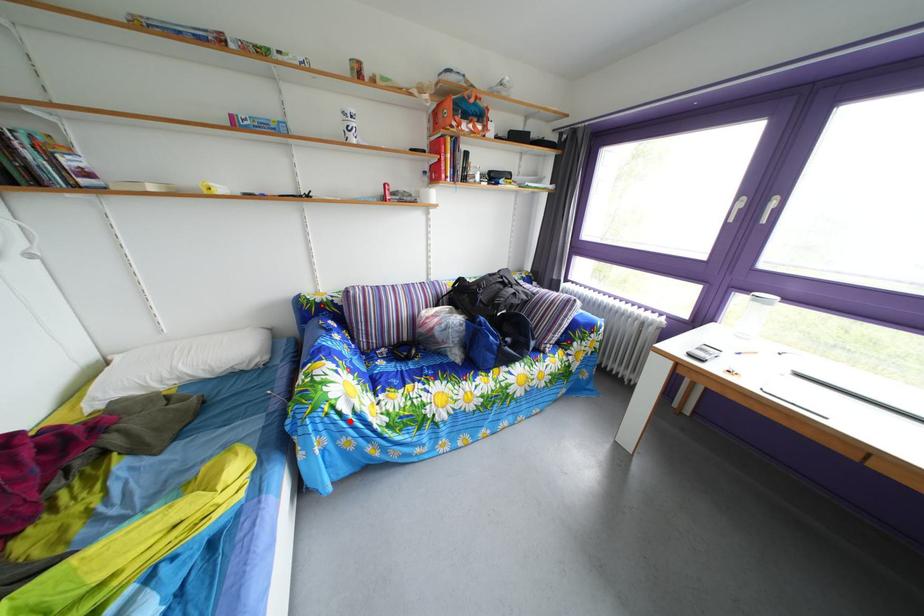
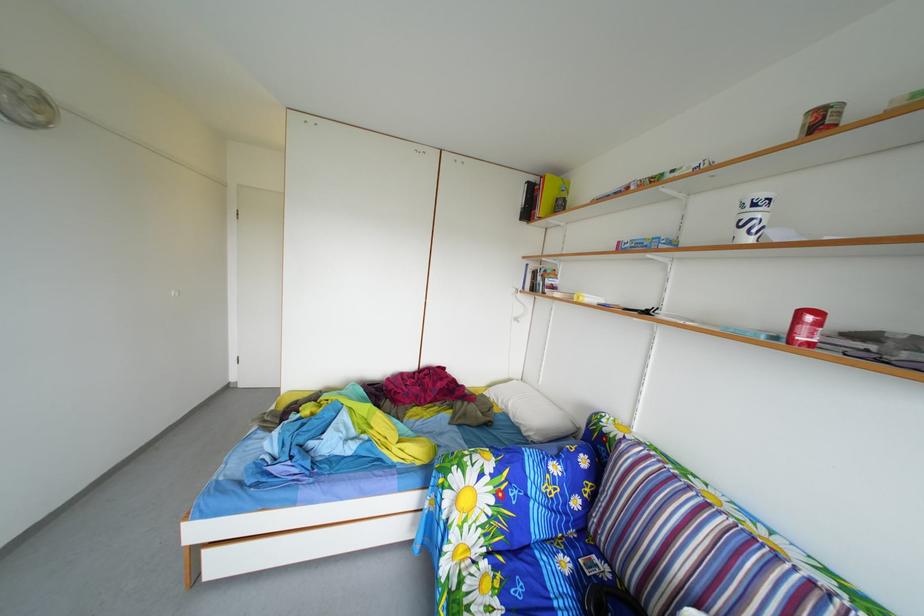
Question: I am providing you with two images of the same scene from different viewpoints. In image1, a red point is highlighted. Considering the same 3D point in image2, which of the following is correct?

Choices:
 (A) It is closer
 (B) It is farther

Answer: (B)